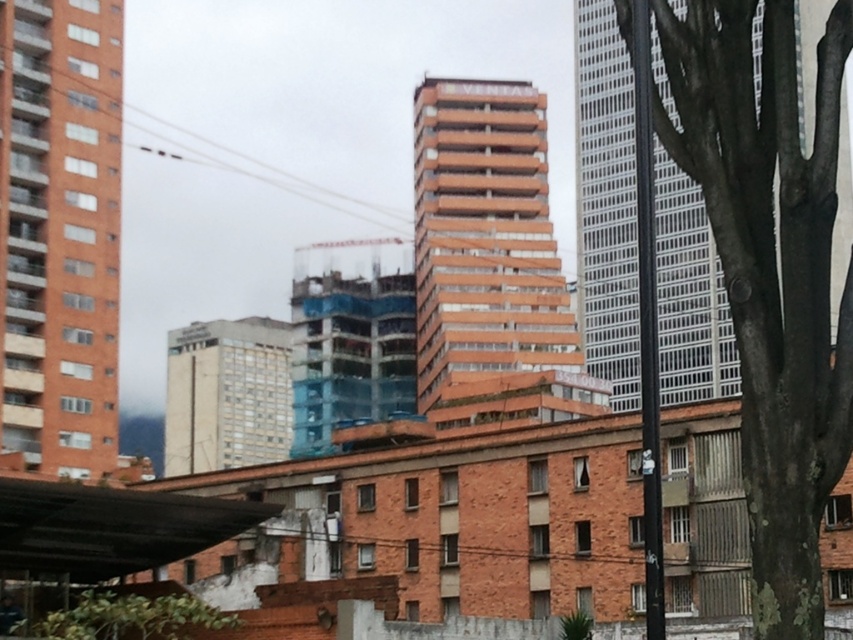
Is green rough bark tree at right above green leafy tree at lower left?

Correct, green rough bark tree at right is located above green leafy tree at lower left.

Does green rough bark tree at right have a greater width compared to green leafy tree at lower left?

Indeed, green rough bark tree at right has a greater width compared to green leafy tree at lower left.

You are a GUI agent. You are given a task and a screenshot of the screen. Output one action in this format:
    pyautogui.click(x=<x>, y=<y>)
    Task: Click on the green rough bark tree at right
    The image size is (853, 640).
    Given the screenshot: What is the action you would take?
    pyautogui.click(x=770, y=272)

Is green rough bark tree at right positioned in front of metallic silver pole at right?

Yes, it is in front of metallic silver pole at right.

Does green rough bark tree at right appear on the left side of metallic silver pole at right?

Correct, you'll find green rough bark tree at right to the left of metallic silver pole at right.

Who is more forward, (833, 182) or (634, 81)?

Point (833, 182)

At what (x,y) coordinates should I click in order to perform the action: click on green rough bark tree at right. Please return your answer as a coordinate pair (x, y). Looking at the image, I should click on (770, 272).

Between point (639, 4) and point (136, 614), which one is positioned in front?

Positioned in front is point (639, 4).

You are a GUI agent. You are given a task and a screenshot of the screen. Output one action in this format:
    pyautogui.click(x=<x>, y=<y>)
    Task: Click on the metallic silver pole at right
    The image size is (853, 640).
    Given the screenshot: What is the action you would take?
    pyautogui.click(x=647, y=321)